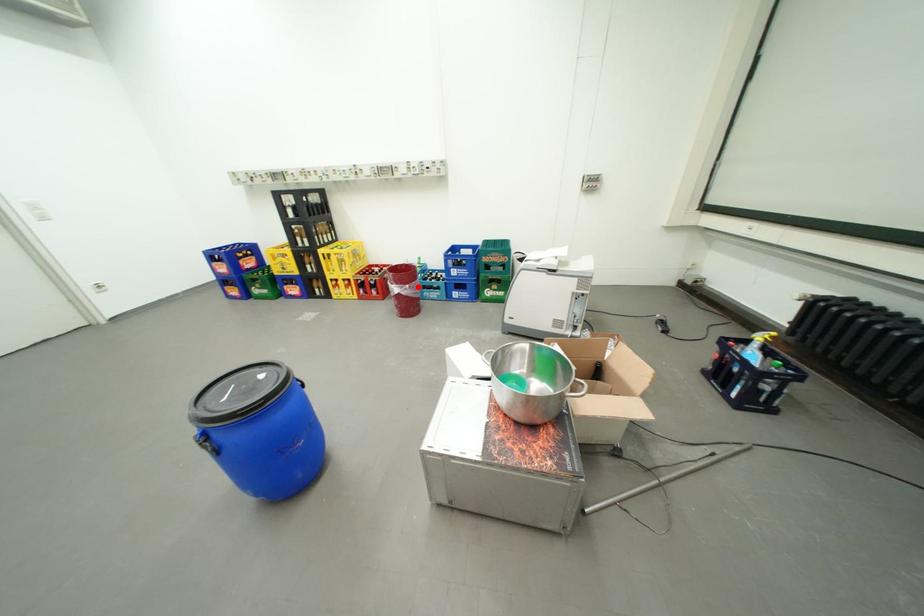
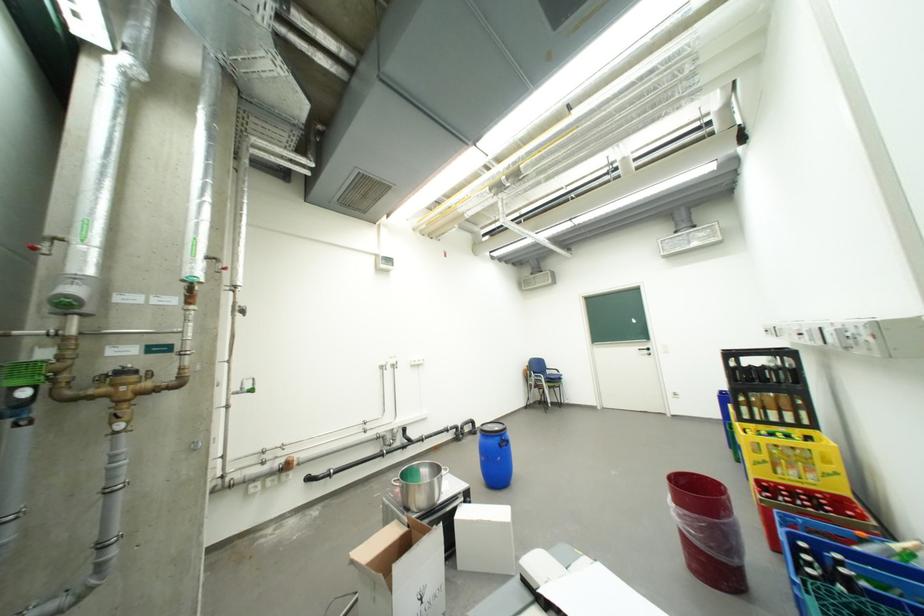
In the second image, find the point that corresponds to the highlighted location in the first image.

(685, 507)